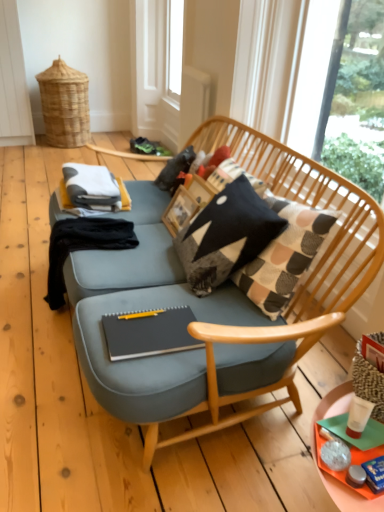
From the picture: Measure the distance between point [370,106] and camera.

Point [370,106] and camera are 2.24 meters apart.

What do you see at coordinates (343, 91) in the screenshot?
I see `transparent glass window at upper right` at bounding box center [343, 91].

What do you see at coordinates (226, 236) in the screenshot? The height and width of the screenshot is (512, 384). I see `knitted fabric pillow at center` at bounding box center [226, 236].

What is the approximate width of orange plastic tray at lower right?

It is 22.59 centimeters.

Where is `orange plastic tray at lower right`? This screenshot has width=384, height=512. orange plastic tray at lower right is located at coordinates (319, 458).

What is the approximate height of transparent plastic screen door at upper center?

transparent plastic screen door at upper center is 4.29 feet in height.

The image size is (384, 512). Find the location of `transparent glass window at upper right`. transparent glass window at upper right is located at coordinates (343, 91).

Looking at this image, considering the relative positions of orange plastic tray at lower right and transparent plastic screen door at upper center in the image provided, is orange plastic tray at lower right to the right of transparent plastic screen door at upper center from the viewer's perspective?

Correct, you'll find orange plastic tray at lower right to the right of transparent plastic screen door at upper center.

Is orange plastic tray at lower right taller than transparent plastic screen door at upper center?

No.

Looking at this image, from a real-world perspective, is orange plastic tray at lower right positioned above or below transparent plastic screen door at upper center?

In terms of real-world spatial position, orange plastic tray at lower right is below transparent plastic screen door at upper center.

Is orange plastic tray at lower right oriented towards transparent plastic screen door at upper center?

No, orange plastic tray at lower right does not turn towards transparent plastic screen door at upper center.

Considering the sizes of objects black fabric at left and knitted fabric pillow at center in the image provided, who is wider, black fabric at left or knitted fabric pillow at center?

Wider between the two is black fabric at left.

Can you confirm if black fabric at left is positioned to the left of knitted fabric pillow at center?

Yes, black fabric at left is to the left of knitted fabric pillow at center.

Can you tell me how much black fabric at left and knitted fabric pillow at center differ in facing direction?

The angular difference between black fabric at left and knitted fabric pillow at center is 3.95 degrees.

In the image, is black fabric at left positioned in front of or behind knitted fabric pillow at center?

black fabric at left is positioned farther from the viewer than knitted fabric pillow at center.

Which point is more forward, (x=317, y=448) or (x=240, y=209)?

Point (x=317, y=448)

Is orange plastic tray at lower right positioned far away from knitted fabric pillow at center?

Actually, orange plastic tray at lower right and knitted fabric pillow at center are a little close together.

Would you say knitted fabric pillow at center is part of orange plastic tray at lower right's contents?

No, knitted fabric pillow at center is located outside of orange plastic tray at lower right.

From a real-world perspective, does orange plastic tray at lower right stand above knitted fabric pillow at center?

Actually, orange plastic tray at lower right is physically below knitted fabric pillow at center in the real world.

From the image's perspective, which one is positioned lower, transparent glass window at upper right or black fabric at left?

black fabric at left appears lower in the image.

Is point (363, 173) positioned before point (92, 230)?

No.

Does transparent glass window at upper right contain black fabric at left?

No.

Does transparent glass window at upper right come in front of black fabric at left?

Yes, transparent glass window at upper right is in front of black fabric at left.

Can you see orange plastic tray at lower right touching black fabric at left?

orange plastic tray at lower right and black fabric at left are clearly separated.

In the scene shown: Is orange plastic tray at lower right spatially inside black fabric at left, or outside of it?

orange plastic tray at lower right is located beyond the bounds of black fabric at left.

Can you confirm if orange plastic tray at lower right is shorter than black fabric at left?

Correct, orange plastic tray at lower right is not as tall as black fabric at left.

From a real-world perspective, is transparent plastic screen door at upper center beneath matte black notebook at center?

No.

Which is behind, transparent plastic screen door at upper center or matte black notebook at center?

transparent plastic screen door at upper center.

Is transparent plastic screen door at upper center to the left of matte black notebook at center from the viewer's perspective?

Indeed, transparent plastic screen door at upper center is positioned on the left side of matte black notebook at center.

Which of these two, transparent plastic screen door at upper center or matte black notebook at center, stands taller?

Standing taller between the two is transparent plastic screen door at upper center.

Can you tell me how much black fabric at left and transparent plastic screen door at upper center differ in facing direction?

The angular difference between black fabric at left and transparent plastic screen door at upper center is 5.09 degrees.

Is black fabric at left oriented towards transparent plastic screen door at upper center?

No, black fabric at left is not aimed at transparent plastic screen door at upper center.

Which is closer to the camera, (50, 237) or (172, 81)?

The point (50, 237) is more forward.

How distant is black fabric at left from transparent plastic screen door at upper center?

black fabric at left is 8.51 feet from transparent plastic screen door at upper center.

I want to click on screen door on the left of orange plastic tray at lower right, so click(157, 69).

You are a GUI agent. You are given a task and a screenshot of the screen. Output one action in this format:
    pyautogui.click(x=<x>, y=<y>)
    Task: Click on the clothing behind the knitted fabric pillow at center
    This screenshot has width=384, height=512.
    Given the screenshot: What is the action you would take?
    pyautogui.click(x=82, y=247)

In the scene shown: Estimate the real-world distances between objects in this image. Which object is further from orange plastic tray at lower right, knitted fabric pillow at center or matte black notebook at center?

knitted fabric pillow at center.

Estimate the real-world distances between objects in this image. Which object is further from matte black notebook at center, black fabric at left or transparent glass window at upper right?

The object further to matte black notebook at center is transparent glass window at upper right.

Based on their spatial positions, is transparent plastic screen door at upper center or transparent glass window at upper right closer to knitted fabric pillow at center?

The object closer to knitted fabric pillow at center is transparent glass window at upper right.

Considering their positions, is matte black notebook at center positioned further to orange plastic tray at lower right than transparent plastic screen door at upper center?

Among the two, transparent plastic screen door at upper center is located further to orange plastic tray at lower right.

From the picture: Which object lies nearer to the anchor point black fabric at left, orange plastic tray at lower right or transparent glass window at upper right?

The object closer to black fabric at left is orange plastic tray at lower right.

Considering their positions, is matte black notebook at center positioned closer to black fabric at left than transparent glass window at upper right?

matte black notebook at center is positioned closer to the anchor black fabric at left.

Which object lies further to the anchor point orange plastic tray at lower right, black fabric at left or transparent plastic screen door at upper center?

transparent plastic screen door at upper center lies further to orange plastic tray at lower right than the other object.

From the picture: Estimate the real-world distances between objects in this image. Which object is further from transparent glass window at upper right, black fabric at left or transparent plastic screen door at upper center?

Among the two, transparent plastic screen door at upper center is located further to transparent glass window at upper right.

In order to click on magazine between black fabric at left and knitted fabric pillow at center in the horizontal direction in this screenshot , I will do `click(149, 333)`.

Where is `pillow between orange plastic tray at lower right and transparent plastic screen door at upper center in the front-back direction`? The image size is (384, 512). pillow between orange plastic tray at lower right and transparent plastic screen door at upper center in the front-back direction is located at coordinates (226, 236).

Where is `pillow between transparent glass window at upper right and matte black notebook at center in the vertical direction`? pillow between transparent glass window at upper right and matte black notebook at center in the vertical direction is located at coordinates (226, 236).

Find the location of a particular element. This screenshot has width=384, height=512. pillow between orange plastic tray at lower right and black fabric at left from front to back is located at coordinates (226, 236).